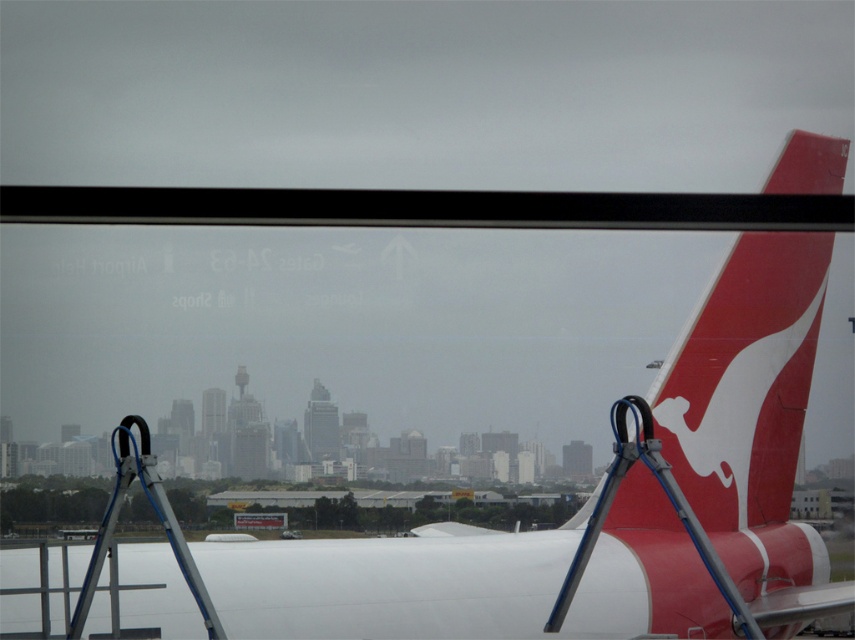
Is red matte airplane tail at right below silver metallic ladder at center?

Actually, red matte airplane tail at right is above silver metallic ladder at center.

Which is in front, point (793, 476) or point (186, 566)?

Positioned in front is point (186, 566).

This screenshot has width=855, height=640. Identify the location of red matte airplane tail at right. (744, 380).